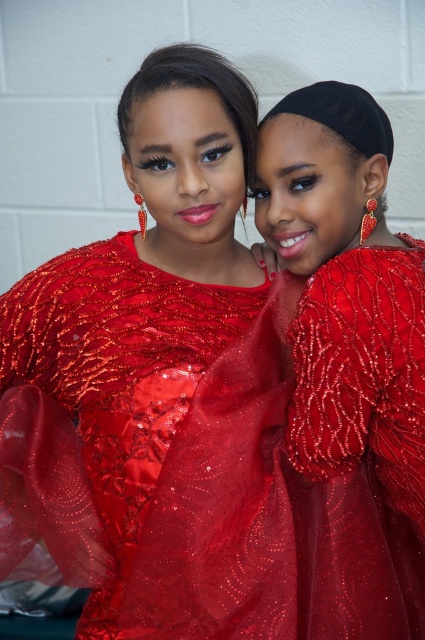
You are a photographer setting up for a photoshoot. You need to position a spotlight so that it illuminates both the shiny sequined dress at center and the beaded silk dress at center without casting shadows. Given their heights, which dress should the spotlight be angled towards first?

The shiny sequined dress at center is taller than the beaded silk dress at center, so the spotlight should be angled towards the shiny sequined dress at center first to ensure both dresses are properly illuminated.

You are a photographer setting up for a photoshoot. The two dresses, shiny sequined dress at center and beaded silk dress at center, are part of the setup. You need to ensure there is enough space between them for a camera to fit. The camera requires a minimum of 8 inches between the dresses to capture both in the frame. Can the camera fit between them?

The shiny sequined dress at center and beaded silk dress at center are 8.35 inches apart from each other. Since the camera requires a minimum of 8 inches, the 8.35 inches is sufficient, so the camera can fit between them.